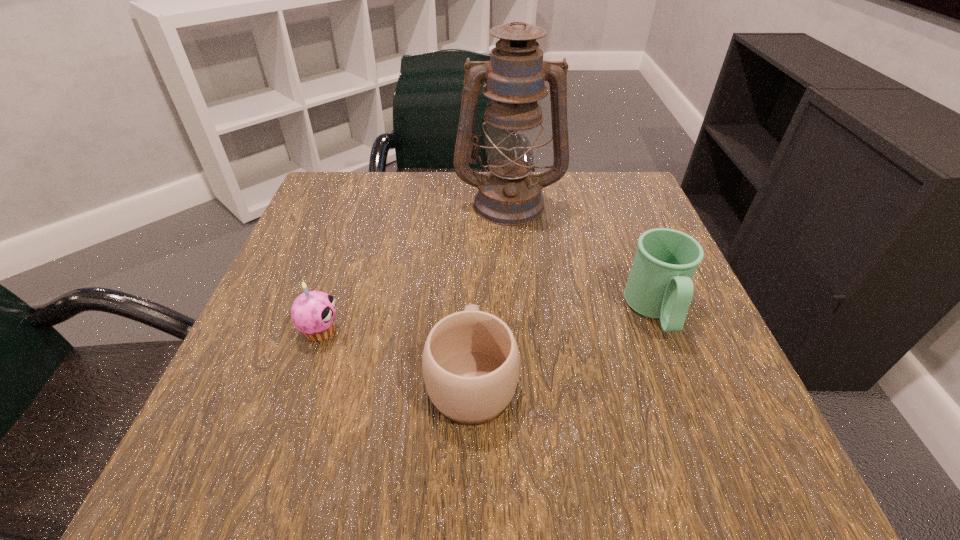
You are a GUI agent. You are given a task and a screenshot of the screen. Output one action in this format:
    pyautogui.click(x=<x>, y=<y>)
    Task: Click on the tallest object
    
    Given the screenshot: What is the action you would take?
    pyautogui.click(x=509, y=194)

Where is `oil lamp`? oil lamp is located at coordinates (509, 194).

Locate an element on the screen. Image resolution: width=960 pixels, height=540 pixels. the right mug is located at coordinates (660, 286).

In order to click on cupcake in this screenshot , I will do `click(313, 313)`.

Locate an element on the screen. Image resolution: width=960 pixels, height=540 pixels. the left mug is located at coordinates (470, 361).

At what (x,y) coordinates should I click in order to perform the action: click on free space located 0.170m on the front of the farthest object. Please return your answer as a coordinate pair (x, y). The image size is (960, 540). Looking at the image, I should click on (516, 280).

Locate an element on the screen. This screenshot has width=960, height=540. vacant space located 0.180m on the side of the right mug with the handle is located at coordinates (710, 453).

Where is `vacant space located 0.100m on the face of the leftmost object`? This screenshot has width=960, height=540. vacant space located 0.100m on the face of the leftmost object is located at coordinates (401, 331).

In order to click on free space located on the side of the left mug with the handle in this screenshot , I will do `click(474, 225)`.

The image size is (960, 540). I want to click on free space located on the side of the left mug with the handle, so [x=474, y=254].